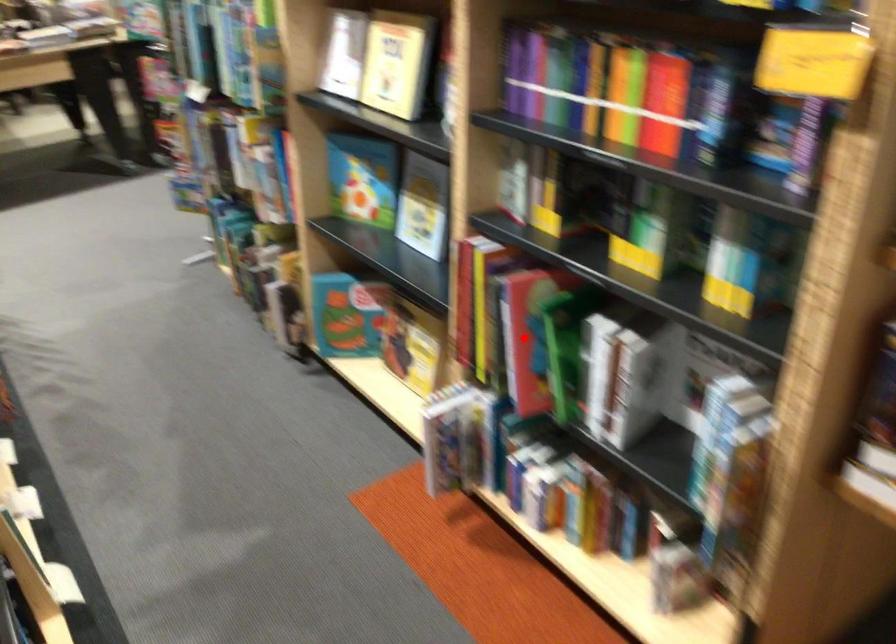
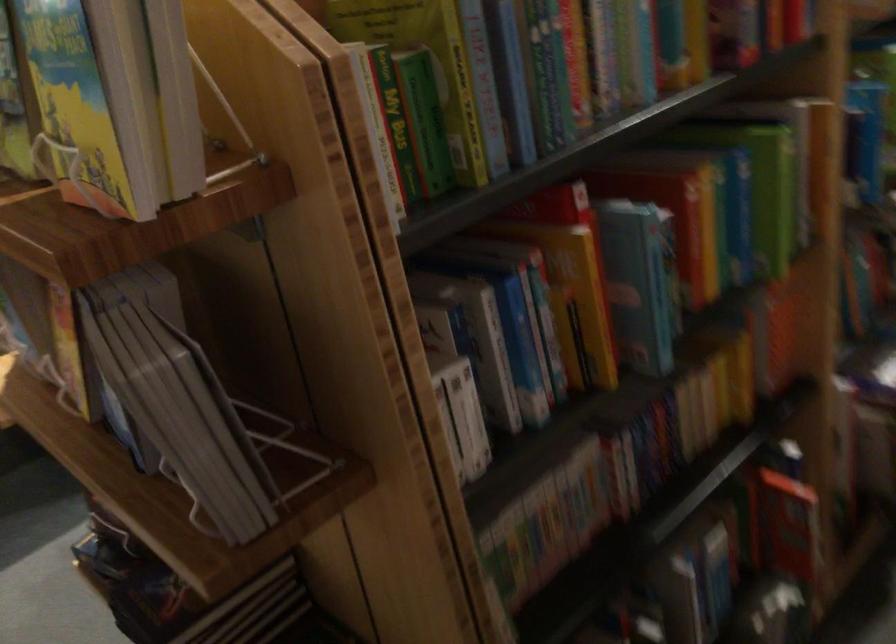
Question: I am providing you with two images of the same scene from different viewpoints. A red point is marked on the first image. Is the red point's position out of view in image 2?

Choices:
 (A) Yes
 (B) No

Answer: (A)